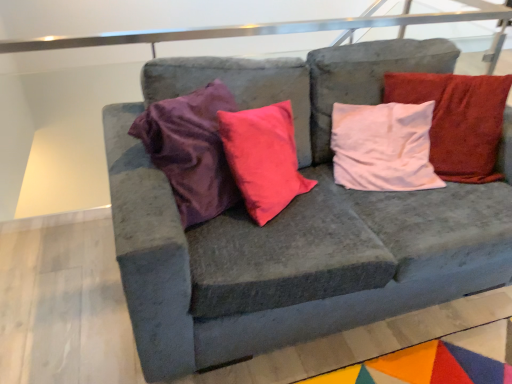
Measure the distance between point [440,160] and camera.

Point [440,160] is 1.77 meters from camera.

At what (x,y) coordinates should I click in order to perform the action: click on multicolored felt mat at lower right. Please return your answer as a coordinate pair (x, y). Image resolution: width=512 pixels, height=384 pixels. Looking at the image, I should click on click(x=436, y=361).

Is multicolored felt mat at lower right bigger than velvet gray couch at center?

Incorrect, multicolored felt mat at lower right is not larger than velvet gray couch at center.

From a real-world perspective, which object stands above the other?

velvet gray couch at center is physically above.

Is multicolored felt mat at lower right in contact with velvet gray couch at center?

multicolored felt mat at lower right and velvet gray couch at center are not in contact.

From the image's perspective, between multicolored felt mat at lower right and velvet gray couch at center, which one is located above?

velvet gray couch at center.

Consider the image. What's the angular difference between velvet gray couch at center and multicolored felt mat at lower right's facing directions?

There is a 88-degree angle between the facing directions of velvet gray couch at center and multicolored felt mat at lower right.

In terms of width, does velvet gray couch at center look wider or thinner when compared to multicolored felt mat at lower right?

velvet gray couch at center is thinner than multicolored felt mat at lower right.

From the image's perspective, is velvet gray couch at center on multicolored felt mat at lower right?

Yes.

Considering the positions of objects velvet gray couch at center and white soft pillow at upper right in the image provided, who is more to the right, velvet gray couch at center or white soft pillow at upper right?

white soft pillow at upper right is more to the right.

Are velvet gray couch at center and white soft pillow at upper right making contact?

They are not placed beside each other.

Based on the photo, can you confirm if velvet gray couch at center is taller than white soft pillow at upper right?

Correct, velvet gray couch at center is much taller as white soft pillow at upper right.

Does point (407, 376) lie behind point (456, 85)?

No, (407, 376) is in front of (456, 85).

In terms of height, does multicolored felt mat at lower right look taller or shorter compared to white soft pillow at upper right?

multicolored felt mat at lower right is shorter than white soft pillow at upper right.

Is multicolored felt mat at lower right outside of white soft pillow at upper right?

multicolored felt mat at lower right lies outside white soft pillow at upper right's area.

Looking at this image, from a real-world perspective, is multicolored felt mat at lower right above or below white soft pillow at upper right?

multicolored felt mat at lower right is below white soft pillow at upper right.

How different are the orientations of white soft pillow at upper right and velvet gray couch at center in degrees?

37.4 degrees.

From the image's perspective, between white soft pillow at upper right and velvet gray couch at center, who is located below?

velvet gray couch at center, from the image's perspective.

Considering the relative sizes of white soft pillow at upper right and velvet gray couch at center in the image provided, is white soft pillow at upper right smaller than velvet gray couch at center?

Yes.

Between point (442, 128) and point (352, 286), which one is positioned in front?

The point (352, 286) is more forward.

Considering the relative positions of white soft pillow at upper right and multicolored felt mat at lower right in the image provided, is white soft pillow at upper right to the left of multicolored felt mat at lower right from the viewer's perspective?

In fact, white soft pillow at upper right is to the right of multicolored felt mat at lower right.

How different are the orientations of white soft pillow at upper right and multicolored felt mat at lower right in degrees?

The angular difference between white soft pillow at upper right and multicolored felt mat at lower right is 125 degrees.

Is white soft pillow at upper right inside the boundaries of multicolored felt mat at lower right, or outside?

white soft pillow at upper right exists outside the volume of multicolored felt mat at lower right.

Which is more distant, (449, 91) or (450, 371)?

The point (449, 91) is more distant.

At what (x,y) coordinates should I click in order to perform the action: click on mat behind the velvet gray couch at center. Please return your answer as a coordinate pair (x, y). Image resolution: width=512 pixels, height=384 pixels. Looking at the image, I should click on tap(436, 361).

This screenshot has height=384, width=512. In the image, there is a velvet gray couch at center. In order to click on mat below it (from a real-world perspective) in this screenshot , I will do `click(436, 361)`.

Which object lies further to the anchor point velvet gray couch at center, white soft pillow at upper right or multicolored felt mat at lower right?

Based on the image, multicolored felt mat at lower right appears to be further to velvet gray couch at center.

Looking at this image, based on their spatial positions, is multicolored felt mat at lower right or white soft pillow at upper right closer to velvet gray couch at center?

white soft pillow at upper right lies closer to velvet gray couch at center than the other object.

When comparing their distances from multicolored felt mat at lower right, does white soft pillow at upper right or velvet gray couch at center seem closer?

Based on the image, velvet gray couch at center appears to be nearer to multicolored felt mat at lower right.

From the image, which object appears to be farther from multicolored felt mat at lower right, velvet gray couch at center or white soft pillow at upper right?

Based on the image, white soft pillow at upper right appears to be further to multicolored felt mat at lower right.

From the image, which object appears to be nearer to white soft pillow at upper right, multicolored felt mat at lower right or velvet gray couch at center?

velvet gray couch at center is positioned closer to the anchor white soft pillow at upper right.

Estimate the real-world distances between objects in this image. Which object is closer to white soft pillow at upper right, velvet gray couch at center or multicolored felt mat at lower right?

velvet gray couch at center lies closer to white soft pillow at upper right than the other object.

You are a GUI agent. You are given a task and a screenshot of the screen. Output one action in this format:
    pyautogui.click(x=<x>, y=<y>)
    Task: Click on the studio couch between white soft pillow at upper right and multicolored felt mat at lower right in the up-down direction
    This screenshot has width=512, height=384.
    Given the screenshot: What is the action you would take?
    pyautogui.click(x=294, y=222)